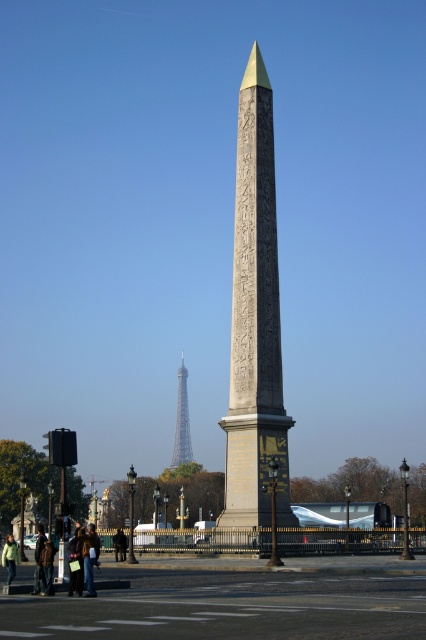
You are an architect designing a new sculpture for the square. You want to place a new metallic gold tower at center that is wider than the existing metallic gold eiffel tower at center. Is this possible based on the current layout?

The metallic gold eiffel tower at center is already wider than the metallic gold tower at center, so placing a new metallic gold tower at center that is wider would not be possible as it would exceed the existing width.

You are a tourist standing in the public square in front of the Luxor Obelisk. You notice the metallic gold eiffel tower at center and the green fabric jacket at lower left. Which object is closer to you?

The metallic gold eiffel tower at center is closer to you because the green fabric jacket at lower left is behind it.

Consider the image. You are an architect designing a new sculpture for the square. You want to place a new bronze statue between the metallic gold eiffel tower at center and the metallic gold tower at center. Which one should the statue be closer to so that it doesn

The metallic gold eiffel tower at center is in front of the metallic gold tower at center. Therefore, the statue should be placed closer to the metallic gold eiffel tower at center to maintain the spatial relationship between the two existing structures.